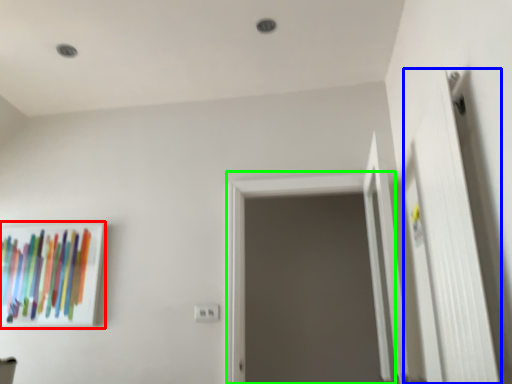
Question: Which object is positioned closest to picture frame (highlighted by a red box)? Select from door (highlighted by a blue box) and screen door (highlighted by a green box).

Choices:
 (A) door
 (B) screen door

Answer: (B)